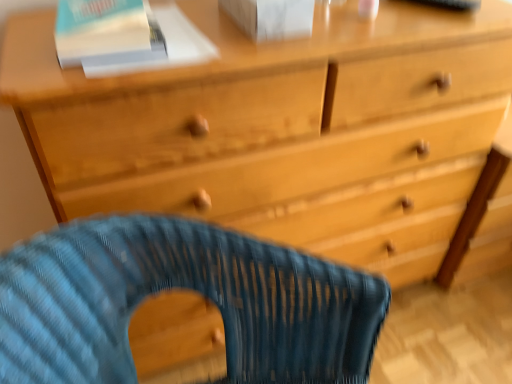
Question: From a real-world perspective, is blue woven fabric rocking chair at lower center above or below white matte paperback book at upper center, the second paperback book positioned from the left?

Choices:
 (A) above
 (B) below

Answer: (B)

Question: Considering the positions of blue woven fabric rocking chair at lower center and white matte paperback book at upper center, the second paperback book positioned from the left, in the image, is blue woven fabric rocking chair at lower center taller or shorter than white matte paperback book at upper center, the second paperback book positioned from the left,?

Choices:
 (A) tall
 (B) short

Answer: (A)

Question: Estimate the real-world distances between objects in this image. Which object is closer to the white matte paperback book at upper center, the second paperback book positioned from the left?

Choices:
 (A) white paper at upper left, marked as the 2th paperback book in a right-to-left arrangement
 (B) blue woven fabric rocking chair at lower center

Answer: (A)

Question: Based on their relative distances, which object is nearer to the blue woven fabric rocking chair at lower center?

Choices:
 (A) white paper at upper left, marked as the 2th paperback book in a right-to-left arrangement
 (B) white matte paperback book at upper center, the second paperback book positioned from the left

Answer: (A)